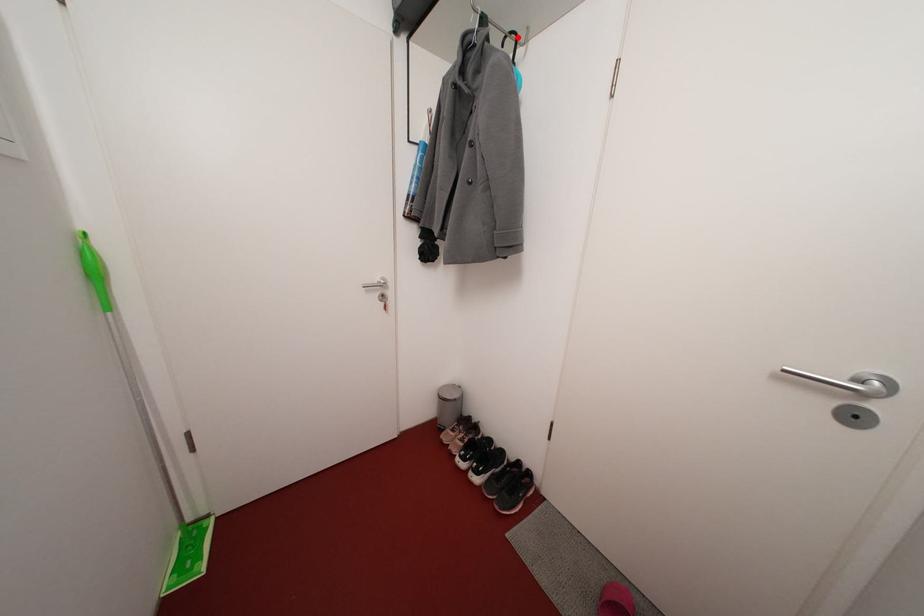
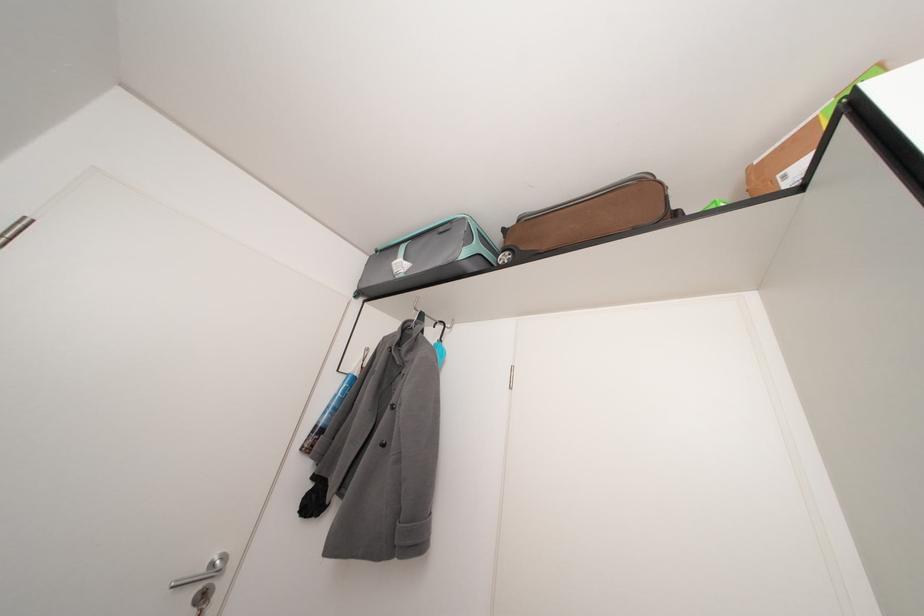
In the second image, find the point that corresponds to the highlighted location in the first image.

(447, 328)